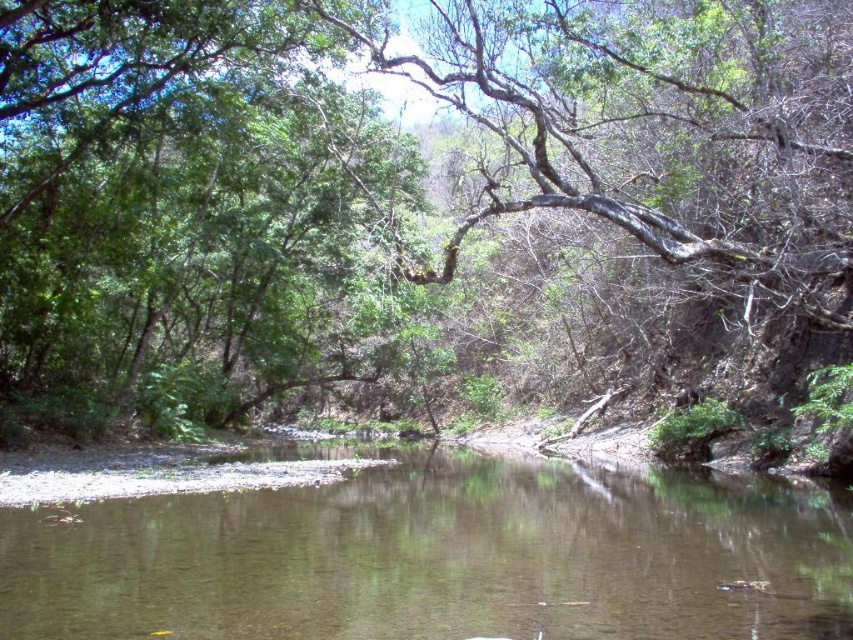
Question: Is green leafy tree at center to the right of brown/reflective water at center from the viewer's perspective?

Choices:
 (A) yes
 (B) no

Answer: (B)

Question: Can you confirm if green leafy tree at center is positioned below brown/reflective water at center?

Choices:
 (A) no
 (B) yes

Answer: (A)

Question: Which point is farther to the camera?

Choices:
 (A) (120, 259)
 (B) (669, 637)

Answer: (A)

Question: Is green leafy tree at center above brown/reflective water at center?

Choices:
 (A) no
 (B) yes

Answer: (B)

Question: Which object is closer to the camera taking this photo?

Choices:
 (A) brown/reflective water at center
 (B) green leafy tree at center

Answer: (B)